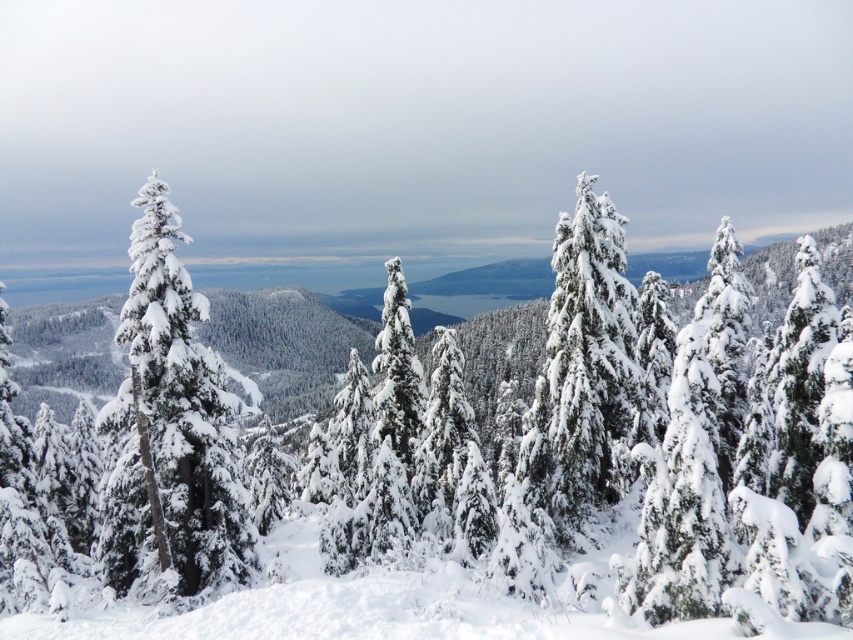
Question: Which of the following is the closest to the observer?

Choices:
 (A) (236, 566)
 (B) (664, 445)

Answer: (B)

Question: Is snow-covered evergreen at center to the right of snow-covered evergreen at left from the viewer's perspective?

Choices:
 (A) yes
 (B) no

Answer: (A)

Question: Does snow-covered evergreen at center appear under snow-covered evergreen at left?

Choices:
 (A) yes
 (B) no

Answer: (B)

Question: Which point is closer to the camera?

Choices:
 (A) snow-covered evergreen at center
 (B) snow-covered evergreen at left

Answer: (A)

Question: Where is snow-covered evergreen at center located in relation to snow-covered evergreen at left in the image?

Choices:
 (A) left
 (B) right

Answer: (B)

Question: Which of the following is the closest to the observer?

Choices:
 (A) snow-covered evergreen at left
 (B) snow-covered evergreen at center

Answer: (B)